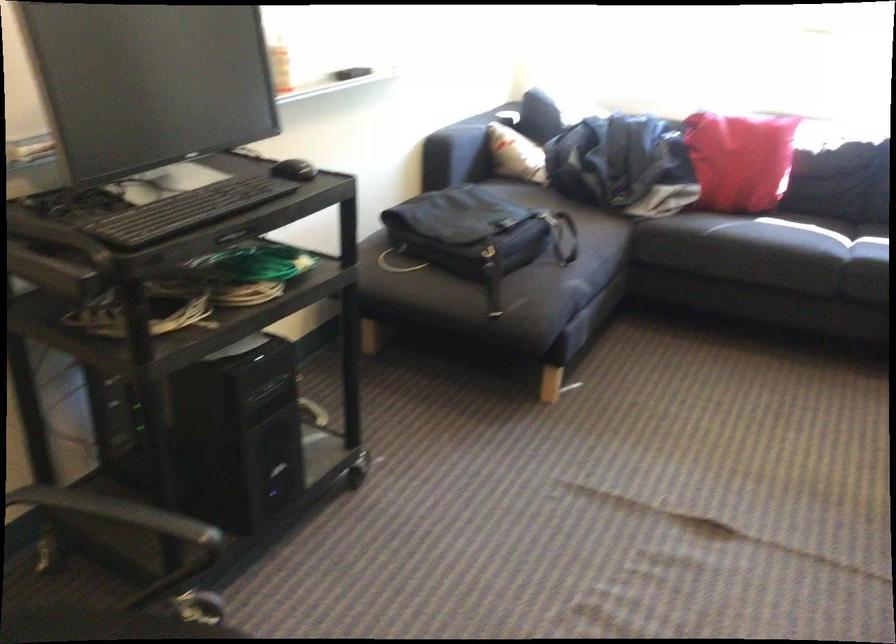
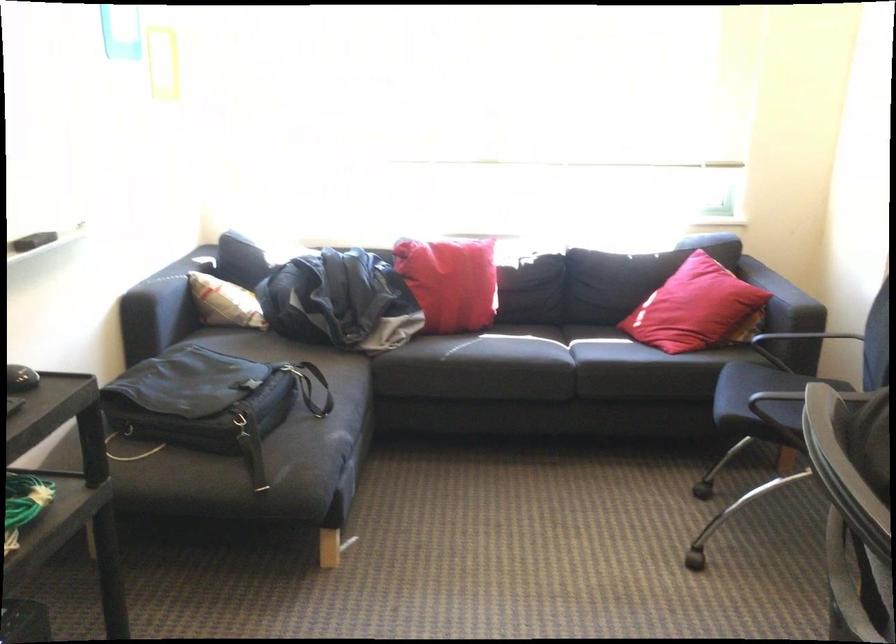
Locate, in the second image, the point that corresponds to [737,158] in the first image.

(450, 281)